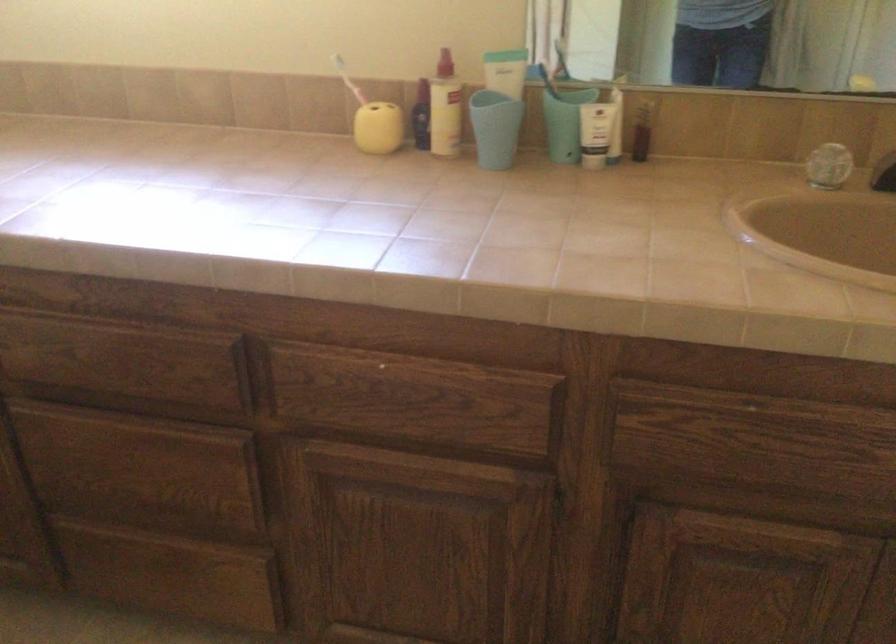
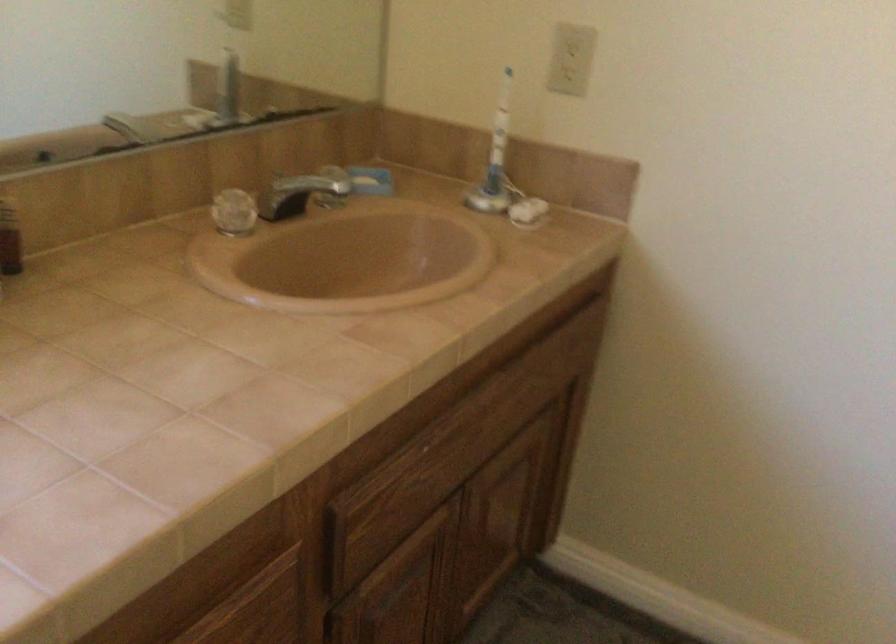
Locate, in the second image, the point that corresponds to the point at 824,158 in the first image.

(234, 212)